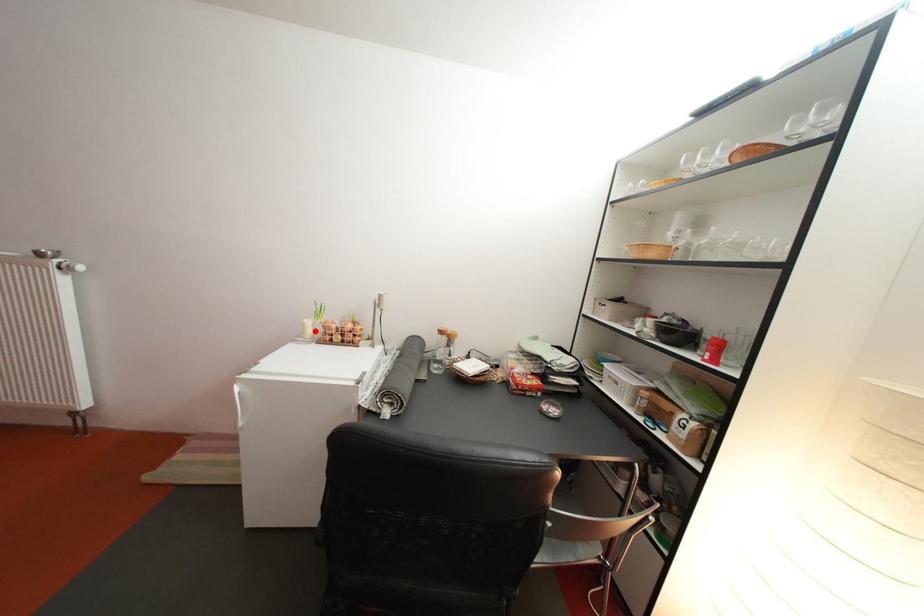
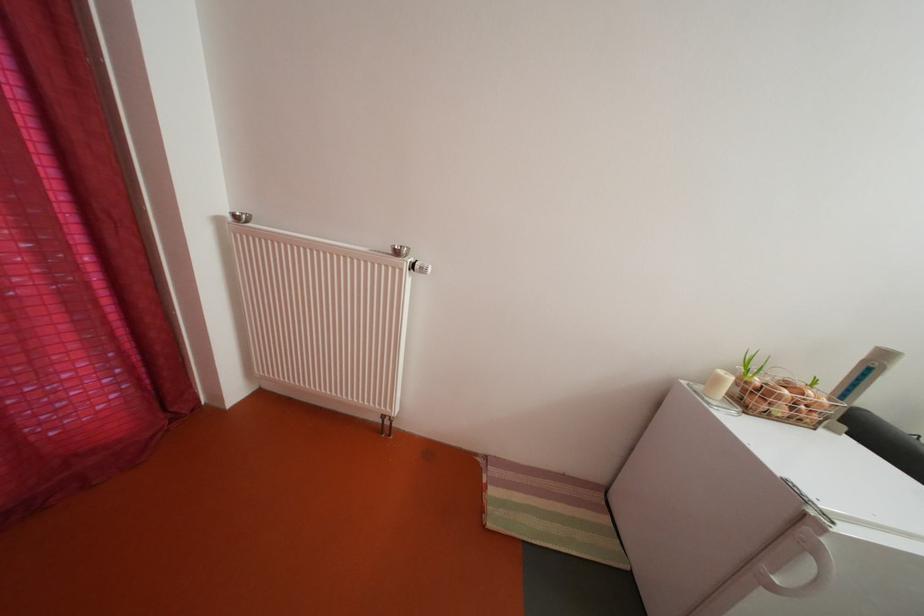
Locate, in the second image, the point that corresponds to the highlighted location in the first image.

(728, 386)